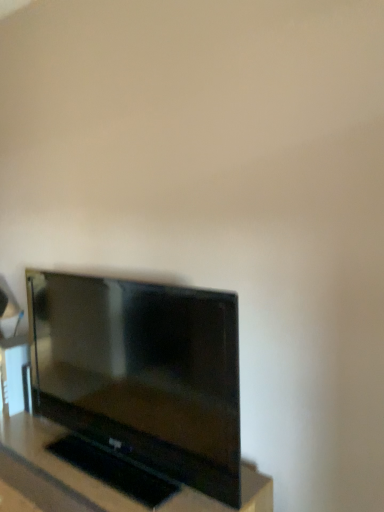
In order to click on free area below matte black tv at lower left (from a real-world perspective) in this screenshot , I will do `click(100, 458)`.